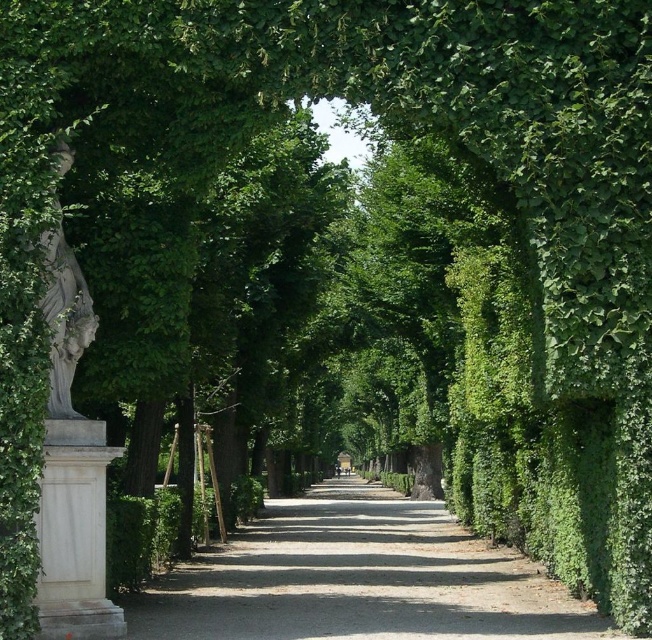
You are a visitor walking along the garden pathway and notice two objects on the left side of the image. Which one is positioned further to the right between the white marble pillar at left and the white stone statue at left?

The white marble pillar at left is positioned to the right of the white stone statue at left, so the white marble pillar at left is further to the right.

You are standing at the entrance of the garden pathway and see two points marked in the image. Which point is closer to you, point (x=55, y=614) or point (x=82, y=310)?

Point (x=55, y=614) is in front of point (x=82, y=310), so it is closer to you.

You are a visitor walking along the garden pathway and want to see both the white marble pillar at left and the white stone statue at left clearly. Since you can only stand at one spot, which object should you move closer to in order to see both objects better?

You should move closer to the white marble pillar at left. Since the white stone statue at left is behind the white marble pillar at left, moving closer to the pillar will allow you to see both objects without obstruction.